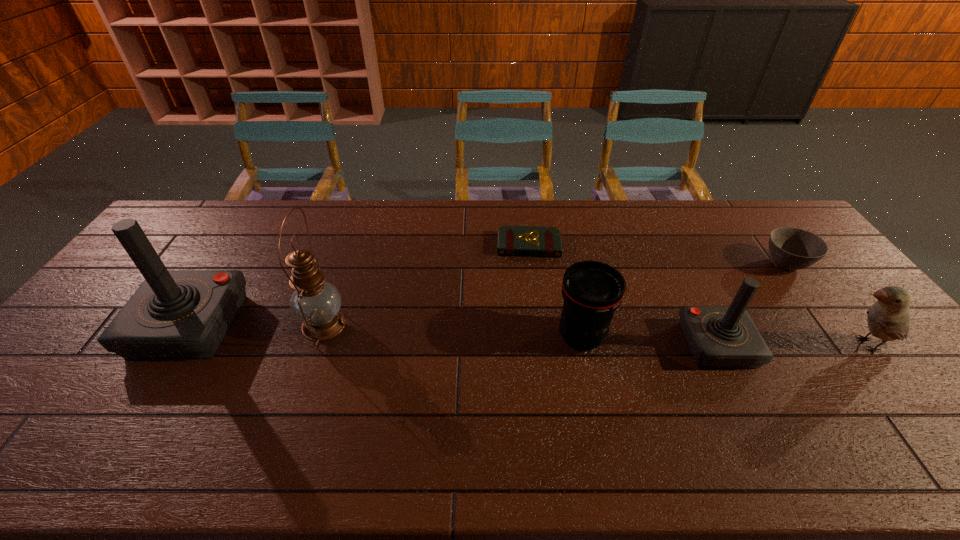
You are a GUI agent. You are given a task and a screenshot of the screen. Output one action in this format:
    pyautogui.click(x=<x>, y=<y>)
    Task: Click on the free spot that satisfies the following two spatial constraints: 1. on the rectangular base of the leftmost object; 2. on the left side of the telephoto lens
    
    Given the screenshot: What is the action you would take?
    pyautogui.click(x=183, y=336)